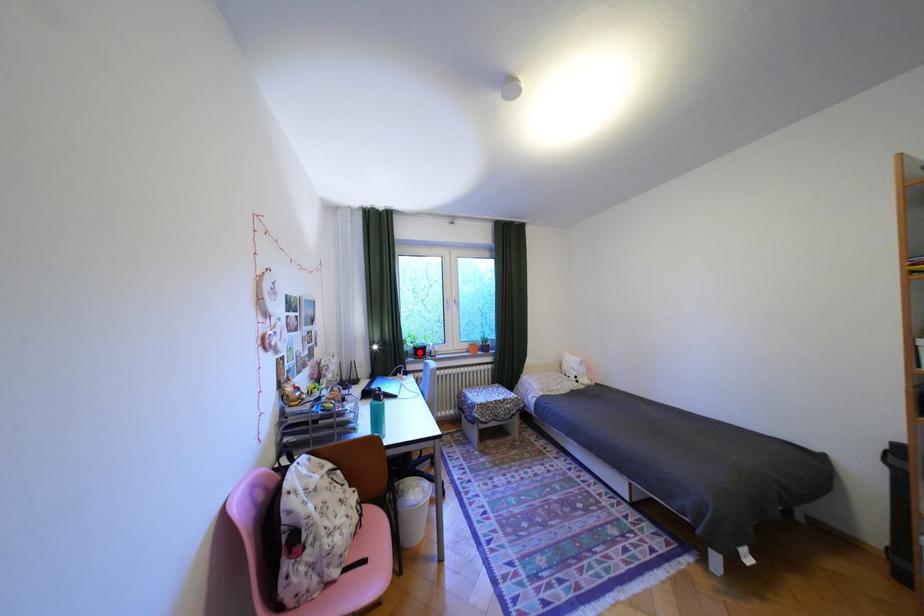
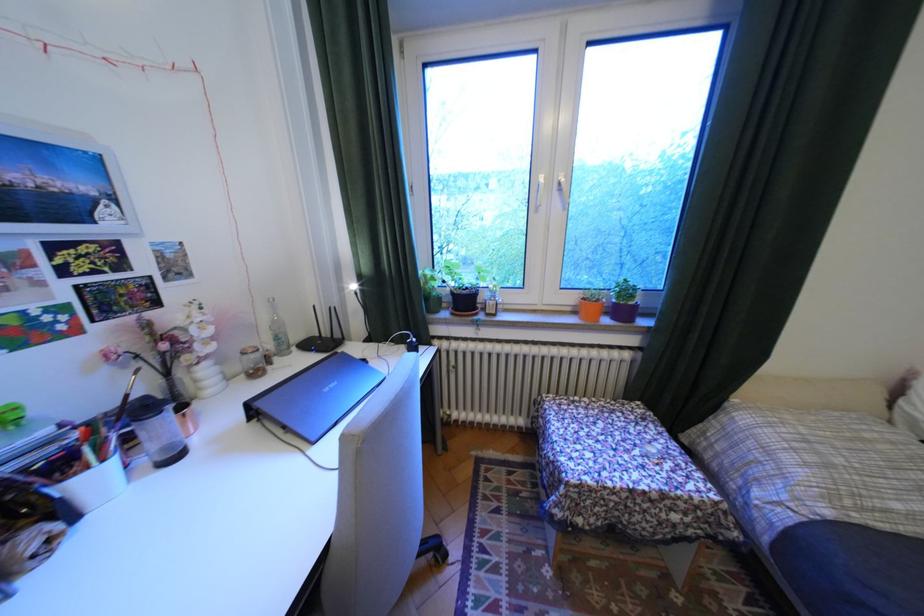
In the second image, find the point that corresponds to the highlighted location in the first image.

(451, 299)